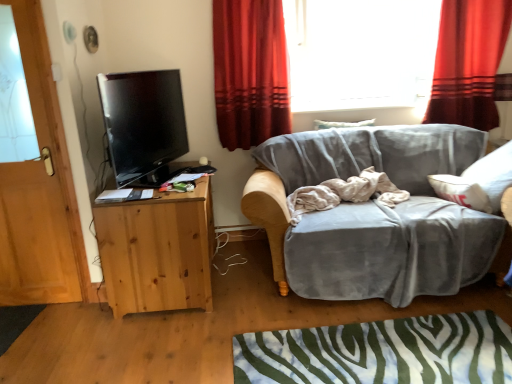
The width and height of the screenshot is (512, 384). I want to click on free space between natural wood cabinet at left and velvet gray couch at center, so click(228, 281).